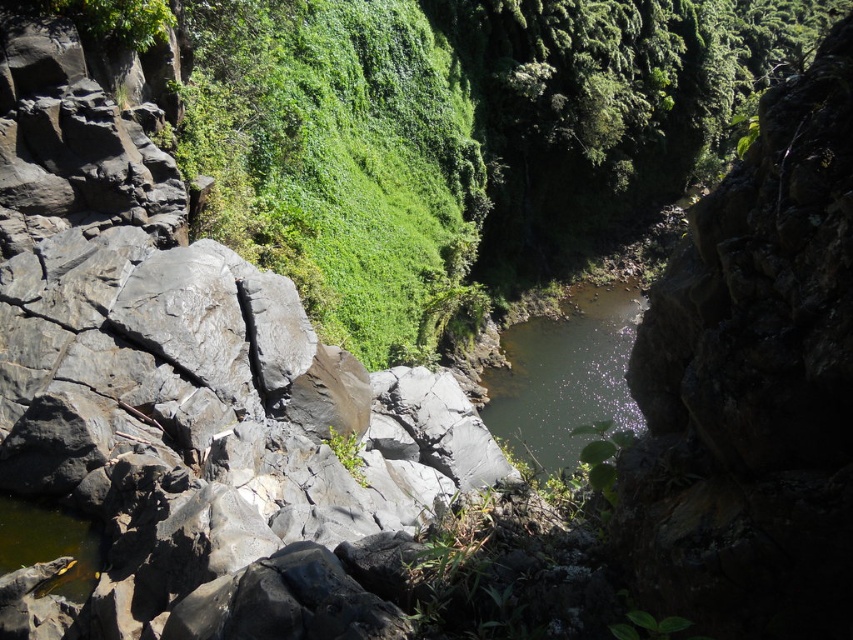
Can you confirm if green leafy vegetation at center is thinner than greenish reflective water at center?

Correct, green leafy vegetation at center's width is less than greenish reflective water at center's.

Who is more distant from viewer, [442,129] or [526,333]?

Positioned behind is point [526,333].

This screenshot has width=853, height=640. I want to click on green leafy vegetation at center, so click(x=340, y=163).